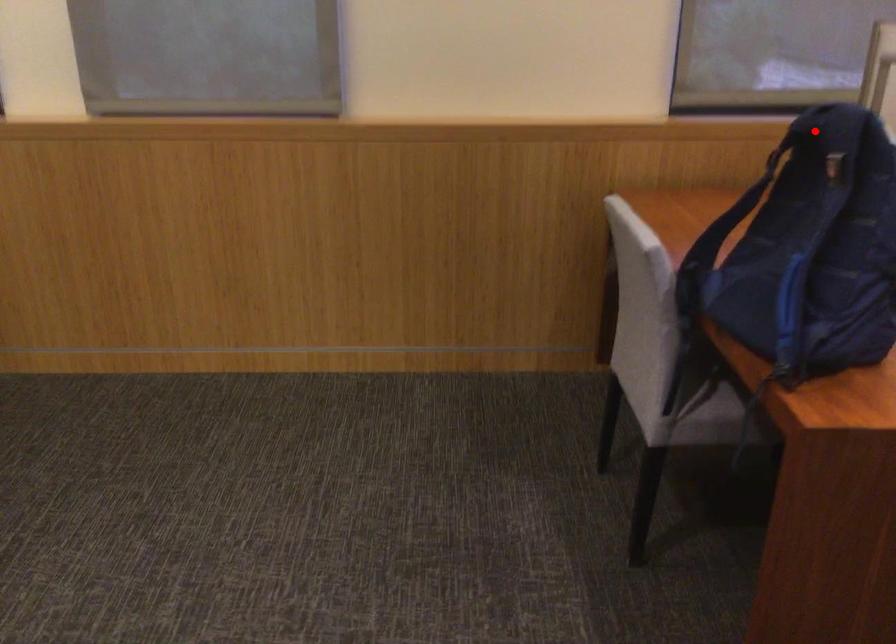
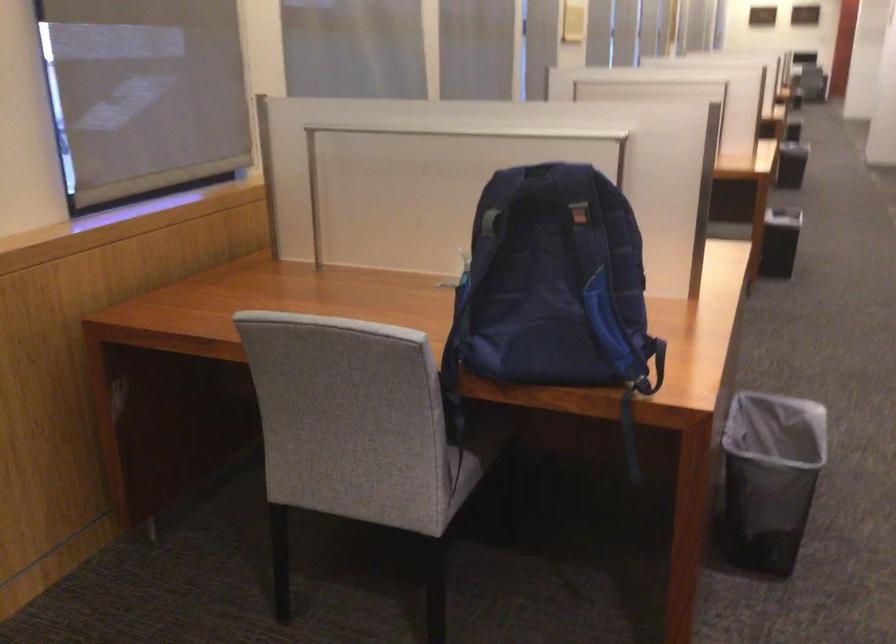
Question: I am providing you with two images of the same scene from different viewpoints. Given a red point in image1, look at the same physical point in image2. Is it:

Choices:
 (A) Closer to the viewpoint
 (B) Farther from the viewpoint

Answer: (B)